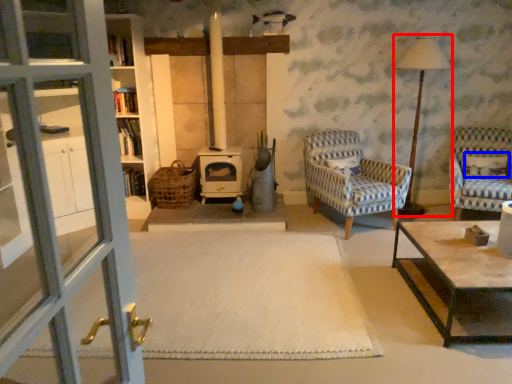
Question: Which point is closer to the camera, table lamp (highlighted by a red box) or pillow (highlighted by a blue box)?

Choices:
 (A) table lamp
 (B) pillow

Answer: (A)